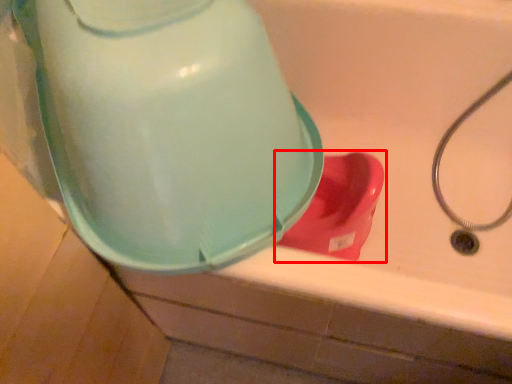
Question: Where is toilet (annotated by the red box) located in relation to water cooler in the image?

Choices:
 (A) right
 (B) left

Answer: (A)